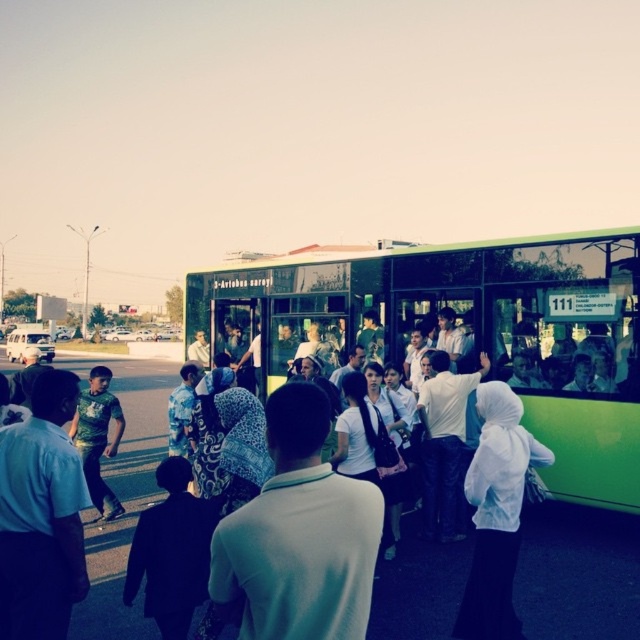
You are a photographer standing at the bus stop. You want to take a photo of the green matte bus at center and the light blue shirt at left. Which object should you focus on first if you want to capture both in the same frame without moving the camera?

The green matte bus at center is much taller than the light blue shirt at left, so you should focus on the green matte bus at center first to ensure it fits within the frame.

You are a photographer at the bus stop and want to capture a photo of the light blue shirt at left and white fabric headscarf at center. Which object is wider in the image?

The white fabric headscarf at center might be wider than light blue shirt at left according to the description.

You are a person standing at the bus stop and want to board the green matte bus at center. There is a white fabric headscarf at center in your way. Can you step over it to get to the bus?

The green matte bus at center is much taller as white fabric headscarf at center, so yes, you can step over the white fabric headscarf at center to reach the green matte bus at center since it is taller than the obstruction.